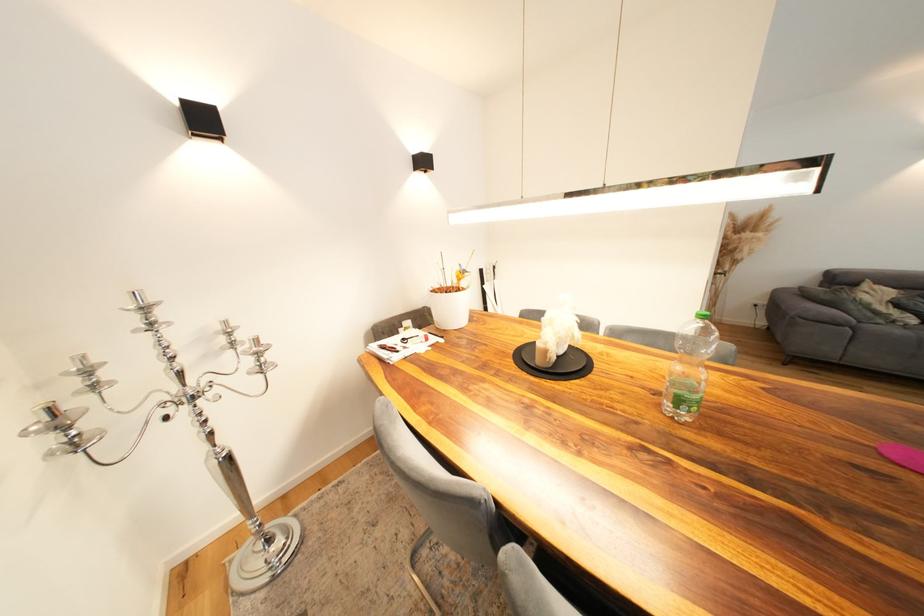
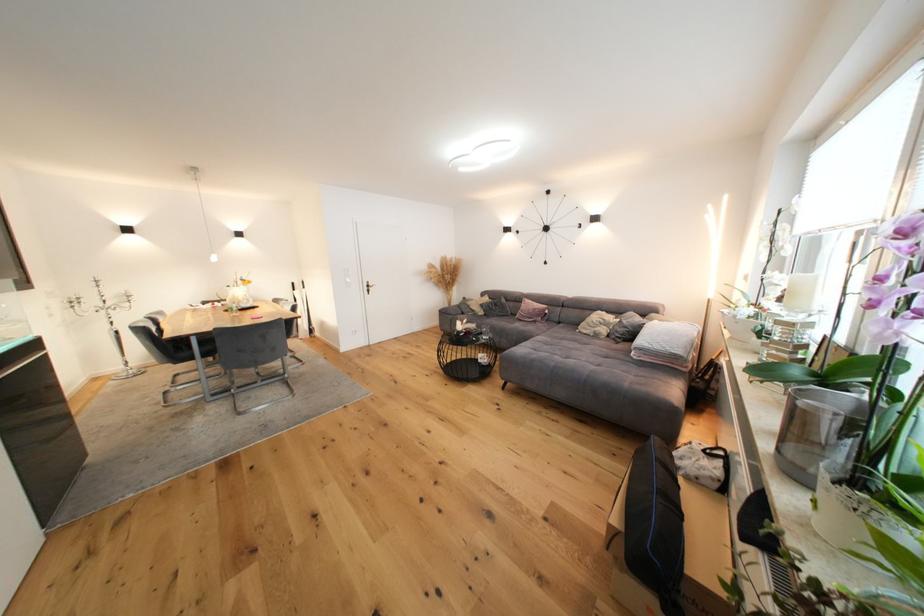
Looking at this image, in a continuous first-person perspective shot, in which direction is the camera moving?

The cameraman moved toward right, backward.